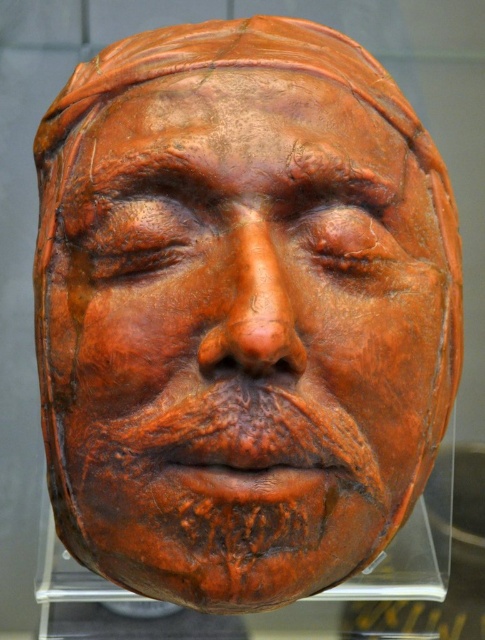
Question: Is matte clay mask at center smaller than transparent plastic mask at center?

Choices:
 (A) yes
 (B) no

Answer: (B)

Question: Is matte clay mask at center thinner than transparent plastic mask at center?

Choices:
 (A) no
 (B) yes

Answer: (B)

Question: Which point is closer to the camera taking this photo?

Choices:
 (A) (107, 624)
 (B) (163, 518)

Answer: (B)

Question: Which point appears farthest from the camera in this image?

Choices:
 (A) (405, 552)
 (B) (226, 144)

Answer: (A)

Question: Does matte clay mask at center have a larger size compared to transparent plastic mask at center?

Choices:
 (A) no
 (B) yes

Answer: (B)